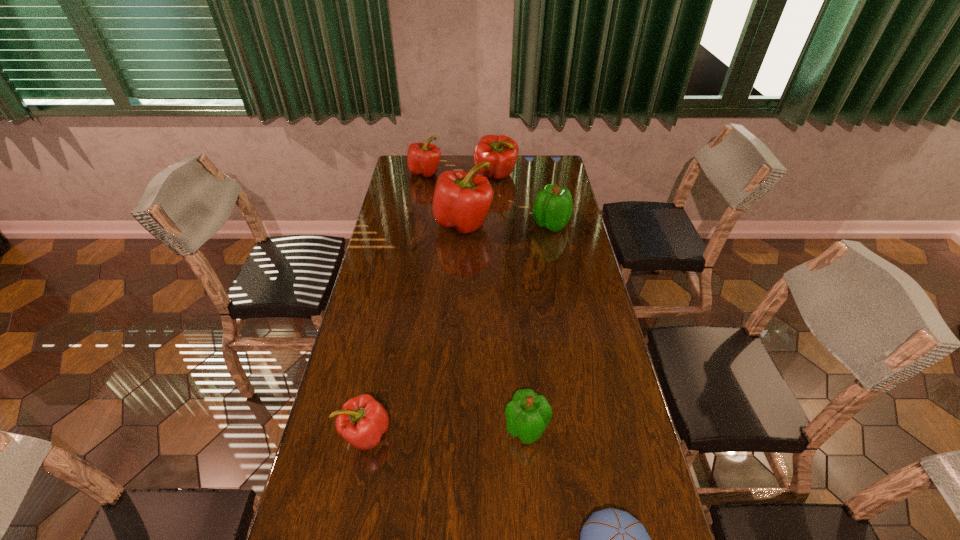
Identify the location of the tallest bell pepper. The width and height of the screenshot is (960, 540). (461, 200).

I want to click on the tallest object, so click(461, 200).

Locate an element on the screen. the second biggest pink bell pepper is located at coordinates (501, 151).

Locate an element on the screen. Image resolution: width=960 pixels, height=540 pixels. the bigger green bell pepper is located at coordinates (552, 209).

This screenshot has height=540, width=960. In order to click on the rightmost bell pepper in this screenshot , I will do `click(552, 209)`.

Identify the location of the second smallest pink bell pepper. The height and width of the screenshot is (540, 960). (423, 159).

The width and height of the screenshot is (960, 540). I want to click on the smaller green bell pepper, so click(528, 414).

Image resolution: width=960 pixels, height=540 pixels. In order to click on the nearer green bell pepper in this screenshot , I will do `click(528, 414)`.

Identify the location of the nearest pink bell pepper. (362, 421).

Find the location of a particular element. This screenshot has width=960, height=540. vacant space situated on the back of the tallest object is located at coordinates (467, 167).